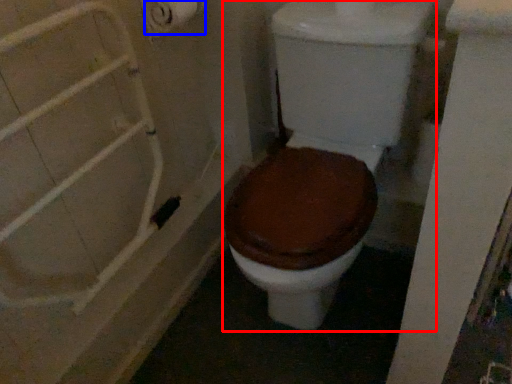
Question: Which point is closer to the camera, toilet (highlighted by a red box) or toilet paper (highlighted by a blue box)?

Choices:
 (A) toilet
 (B) toilet paper

Answer: (A)